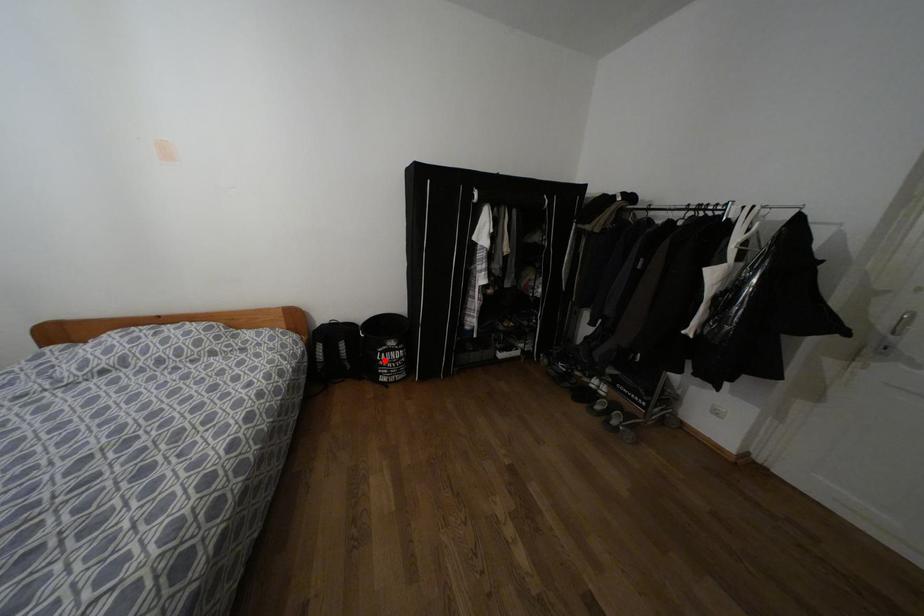
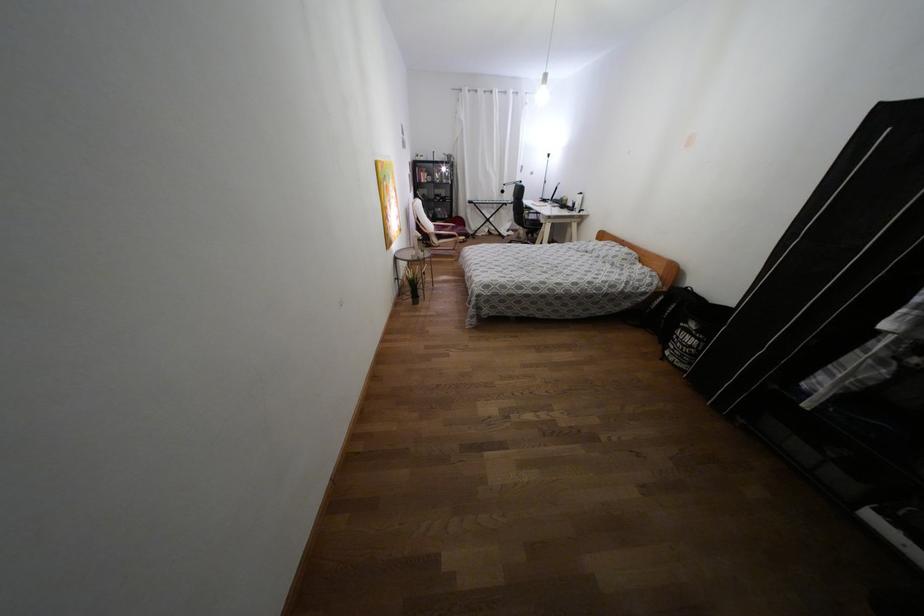
Find the pixel in the second image that matches the highlighted location in the first image.

(676, 337)